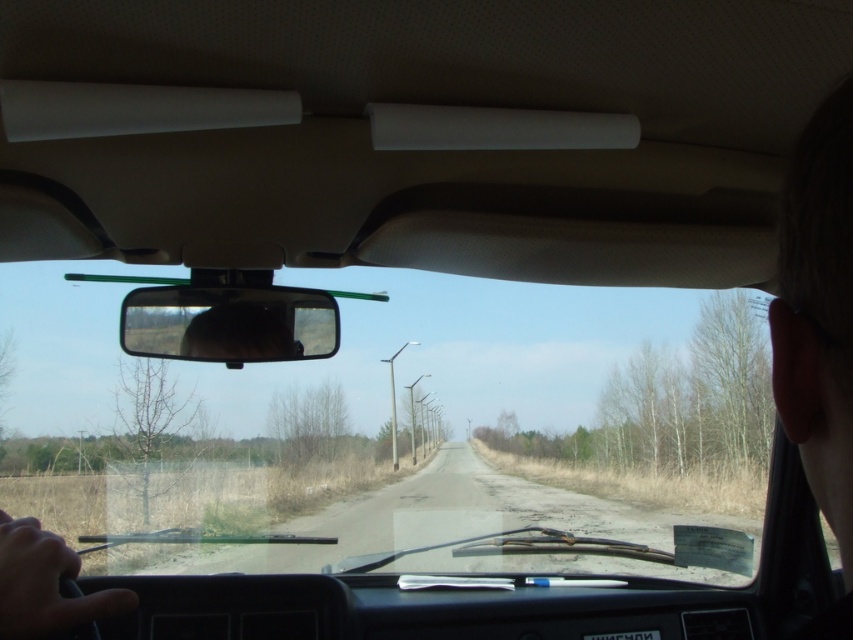
You are driving a car and want to check the road ahead. Which object, the transparent glass windshield at center or the black glossy rearview mirror at center, would you look through to see the road in front of the car?

You would look through the transparent glass windshield at center to see the road in front of the car, since it is located below the black glossy rearview mirror at center and provides a direct view forward.